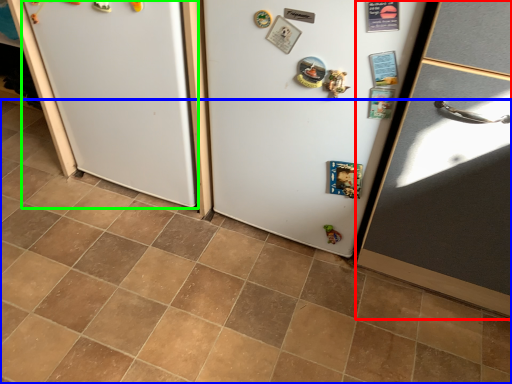
Question: Which is nearer to the door (highlighted by a red box)? tile (highlighted by a blue box) or fridge (highlighted by a green box).

Choices:
 (A) tile
 (B) fridge

Answer: (A)